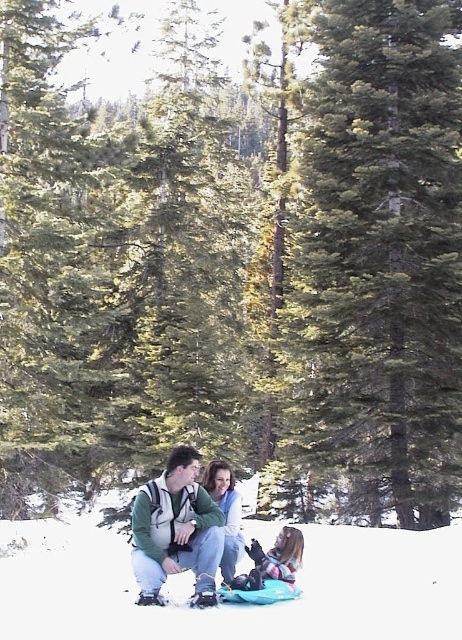
Question: Which object is farther from the camera taking this photo?

Choices:
 (A) matte blue jacket at center
 (B) white fluffy snow at lower center
 (C) green fleece jacket at center
 (D) soft pink fabric at lower center

Answer: (A)

Question: Which of these objects is positioned closest to the green textured pine tree at center?

Choices:
 (A) green fleece jacket at center
 (B) white fluffy snow at lower center

Answer: (B)

Question: Can you confirm if green textured pine tree at center is positioned below matte blue jacket at center?

Choices:
 (A) no
 (B) yes

Answer: (A)

Question: Can you confirm if green textured pine tree at center is positioned to the right of matte blue jacket at center?

Choices:
 (A) yes
 (B) no

Answer: (A)

Question: Which point is farther to the camera?

Choices:
 (A) (230, 541)
 (B) (443, 456)
 (C) (218, 528)

Answer: (B)

Question: Is green textured pine tree at center positioned behind white fluffy snow at lower center?

Choices:
 (A) no
 (B) yes

Answer: (B)